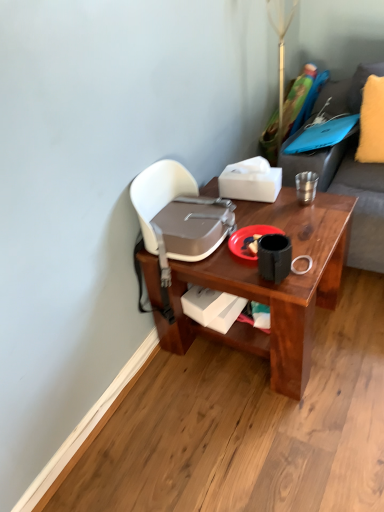
Question: Considering the relative sizes of white matte tissue box at upper center, positioned as the 1th box in top-to-bottom order, and yellow fuzzy pillow at upper right in the image provided, is white matte tissue box at upper center, positioned as the 1th box in top-to-bottom order, bigger than yellow fuzzy pillow at upper right?

Choices:
 (A) yes
 (B) no

Answer: (B)

Question: Is white matte tissue box at upper center, which ranks as the 2th box in bottom-to-top order, looking in the opposite direction of yellow fuzzy pillow at upper right?

Choices:
 (A) no
 (B) yes

Answer: (A)

Question: Does white matte tissue box at upper center, which ranks as the 2th box in bottom-to-top order, have a smaller size compared to yellow fuzzy pillow at upper right?

Choices:
 (A) yes
 (B) no

Answer: (A)

Question: Considering the relative positions of white matte tissue box at upper center, which ranks as the 2th box in bottom-to-top order, and yellow fuzzy pillow at upper right in the image provided, is white matte tissue box at upper center, which ranks as the 2th box in bottom-to-top order, behind yellow fuzzy pillow at upper right?

Choices:
 (A) no
 (B) yes

Answer: (A)

Question: Are white matte tissue box at upper center, positioned as the 1th box in top-to-bottom order, and yellow fuzzy pillow at upper right beside each other?

Choices:
 (A) no
 (B) yes

Answer: (A)

Question: Is red matte plate at center wider or thinner than metallic pole at upper center?

Choices:
 (A) wide
 (B) thin

Answer: (A)

Question: From a real-world perspective, is red matte plate at center physically located above or below metallic pole at upper center?

Choices:
 (A) below
 (B) above

Answer: (A)

Question: Relative to metallic pole at upper center, is red matte plate at center in front or behind?

Choices:
 (A) behind
 (B) front

Answer: (B)

Question: Considering the relative positions of red matte plate at center and metallic pole at upper center in the image provided, is red matte plate at center to the left or to the right of metallic pole at upper center?

Choices:
 (A) right
 (B) left

Answer: (B)

Question: In terms of width, does white matte tissue box at upper center, which ranks as the 2th box in bottom-to-top order, look wider or thinner when compared to white matte box at lower center, the second box positioned from the top?

Choices:
 (A) thin
 (B) wide

Answer: (B)

Question: From a real-world perspective, is white matte tissue box at upper center, positioned as the 1th box in top-to-bottom order, positioned above or below white matte box at lower center, the second box positioned from the top?

Choices:
 (A) below
 (B) above

Answer: (B)

Question: Considering their positions, is white matte tissue box at upper center, positioned as the 1th box in top-to-bottom order, located in front of or behind white matte box at lower center, the 1th box when ordered from bottom to top?

Choices:
 (A) behind
 (B) front

Answer: (A)

Question: Is white matte tissue box at upper center, positioned as the 1th box in top-to-bottom order, inside the boundaries of white matte box at lower center, the 1th box when ordered from bottom to top, or outside?

Choices:
 (A) outside
 (B) inside

Answer: (A)

Question: Considering the positions of white matte tissue box at upper center, which ranks as the 2th box in bottom-to-top order, and metallic pole at upper center in the image, is white matte tissue box at upper center, which ranks as the 2th box in bottom-to-top order, bigger or smaller than metallic pole at upper center?

Choices:
 (A) small
 (B) big

Answer: (A)

Question: In the image, is white matte tissue box at upper center, positioned as the 1th box in top-to-bottom order, positioned in front of or behind metallic pole at upper center?

Choices:
 (A) front
 (B) behind

Answer: (A)